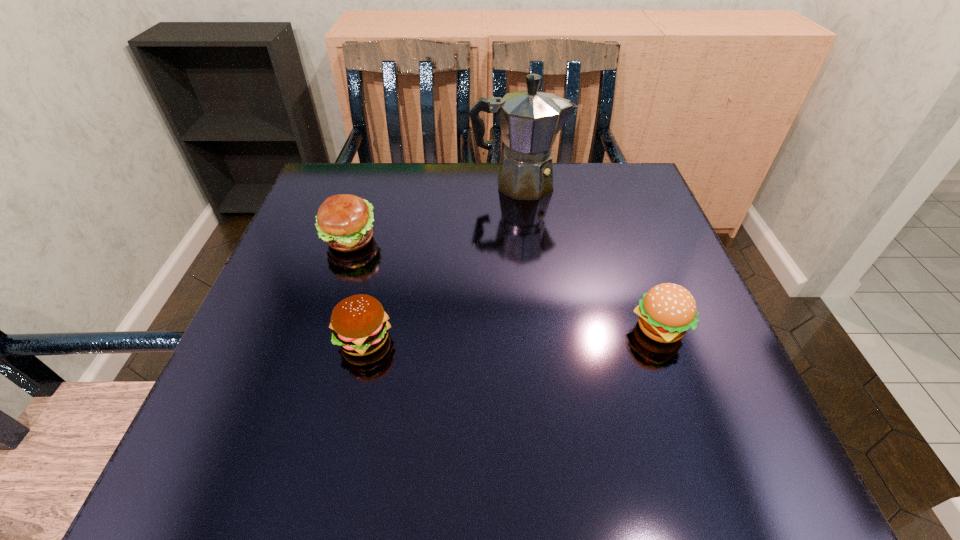
This screenshot has width=960, height=540. I want to click on free space between the farthest hamburger and the rightmost hamburger, so click(504, 284).

Identify the location of free space between the second object from right to left and the rightmost object. The image size is (960, 540). (588, 256).

Choose which object is the second nearest neighbor to the second object from right to left. Please provide its 2D coordinates. Your answer should be formatted as a tuple, i.e. [(x, y)], where the tuple contains the x and y coordinates of a point satisfying the conditions above.

[(667, 311)]

Locate an element on the screen. object that is the second nearest to the rightmost hamburger is located at coordinates (359, 323).

Locate which hamburger ranks second in proximity to the farthest hamburger. Please provide its 2D coordinates. Your answer should be formatted as a tuple, i.e. [(x, y)], where the tuple contains the x and y coordinates of a point satisfying the conditions above.

[(667, 311)]

Locate which hamburger is the second closest to the rightmost hamburger. Please provide its 2D coordinates. Your answer should be formatted as a tuple, i.e. [(x, y)], where the tuple contains the x and y coordinates of a point satisfying the conditions above.

[(344, 221)]

You are a GUI agent. You are given a task and a screenshot of the screen. Output one action in this format:
    pyautogui.click(x=<x>, y=<y>)
    Task: Click on the vacant space that satisfies the following two spatial constraints: 1. on the front side of the rightmost hamburger; 2. on the left side of the second farthest object
    
    Given the screenshot: What is the action you would take?
    pyautogui.click(x=321, y=329)

In order to click on blank area in the image that satisfies the following two spatial constraints: 1. on the pouring side of the farthest object; 2. on the back side of the rightmost object in this screenshot , I will do `click(534, 329)`.

You are a GUI agent. You are given a task and a screenshot of the screen. Output one action in this format:
    pyautogui.click(x=<x>, y=<y>)
    Task: Click on the free spot that satisfies the following two spatial constraints: 1. on the pouring side of the rightmost hamburger; 2. on the right side of the third object from left to right
    This screenshot has width=960, height=540.
    Given the screenshot: What is the action you would take?
    534,329